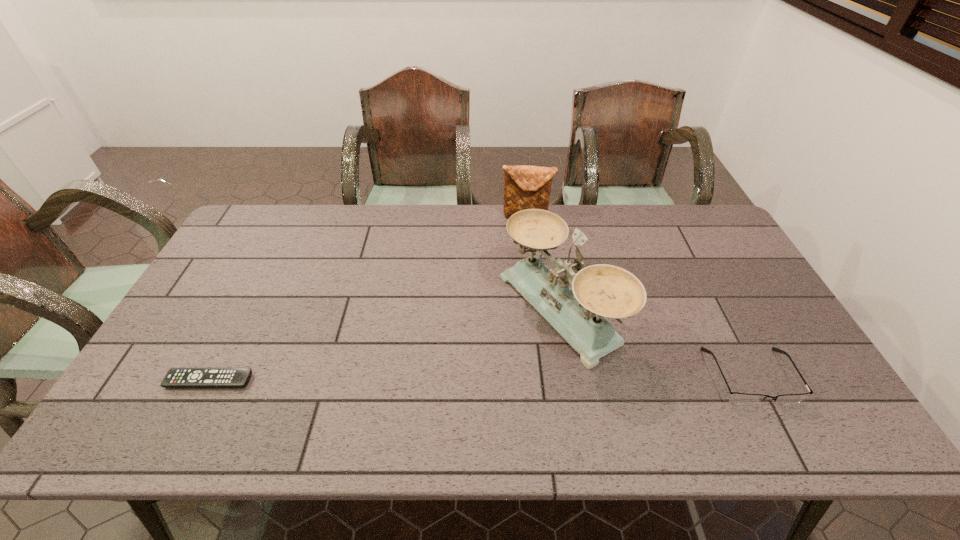
Locate an element on the screen. free spot on the desktop that is between the leftmost object and the rightmost object and is positioned on the open side of the third shortest object is located at coordinates (490, 379).

The height and width of the screenshot is (540, 960). What are the coordinates of `free space on the desktop that is between the shortest object and the spectacles and is positioned on the front-facing side of the scale` in the screenshot? It's located at (425, 379).